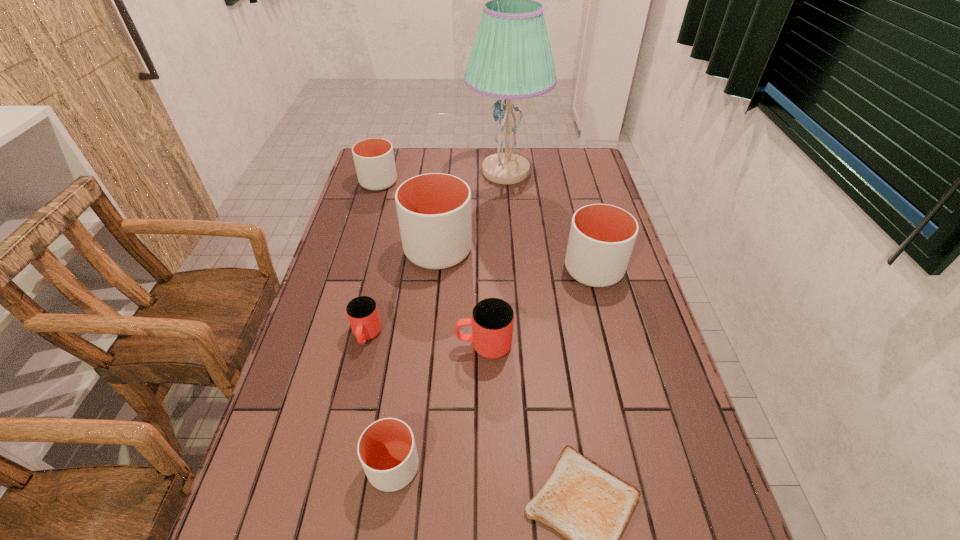
Where is `lamp`? This screenshot has height=540, width=960. lamp is located at coordinates (511, 58).

This screenshot has height=540, width=960. In order to click on teal lamp in this screenshot , I will do `click(511, 58)`.

Locate an element on the screen. the tallest cup is located at coordinates (434, 210).

This screenshot has width=960, height=540. I want to click on the second tallest object, so click(x=434, y=210).

At what (x,y) coordinates should I click in order to perform the action: click on the rightmost cup. Please return your answer as a coordinate pair (x, y). Looking at the image, I should click on (602, 237).

Where is `the rightmost white cup`? This screenshot has height=540, width=960. the rightmost white cup is located at coordinates (602, 237).

Where is `the second smallest white cup`? Image resolution: width=960 pixels, height=540 pixels. the second smallest white cup is located at coordinates (374, 160).

Find the location of a particular element. the farthest white cup is located at coordinates (374, 160).

Identify the location of the right pink cup. Image resolution: width=960 pixels, height=540 pixels. (492, 320).

The width and height of the screenshot is (960, 540). What are the coordinates of `the nearest cup` in the screenshot? It's located at (386, 449).